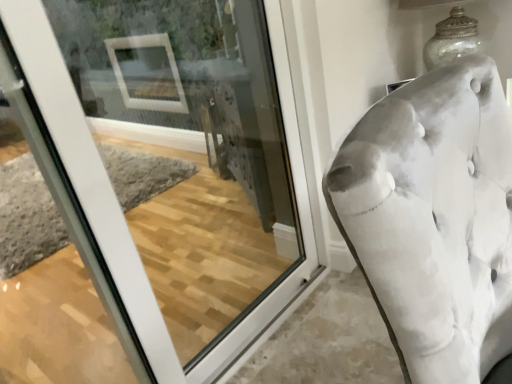
Describe the element at coordinates (158, 192) in the screenshot. I see `transparent glass window at center` at that location.

This screenshot has height=384, width=512. What are the coordinates of `transparent glass window at center` in the screenshot? It's located at (158, 192).

Identify the location of transparent glass window at center. (158, 192).